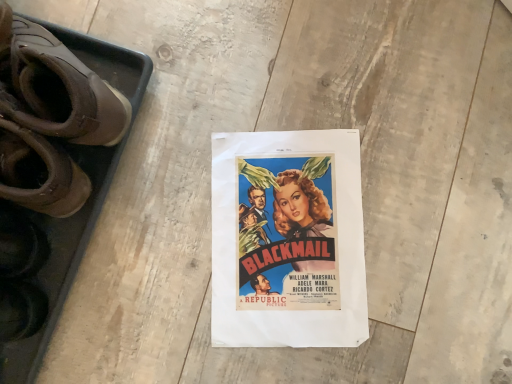
This screenshot has width=512, height=384. I want to click on vivid paper poster at center, so click(x=288, y=240).

The image size is (512, 384). What do you see at coordinates (288, 240) in the screenshot?
I see `vivid paper poster at center` at bounding box center [288, 240].

Image resolution: width=512 pixels, height=384 pixels. In order to click on brown leather shoes at left in this screenshot , I will do `click(62, 91)`.

What do you see at coordinates (62, 91) in the screenshot? I see `brown leather shoes at left` at bounding box center [62, 91].

Measure the distance between point (47, 46) and camera.

They are 22.72 inches apart.

Where is `vivid paper poster at center`? vivid paper poster at center is located at coordinates (288, 240).

Which is more to the left, vivid paper poster at center or brown leather shoes at left?

From the viewer's perspective, brown leather shoes at left appears more on the left side.

Is the depth of vivid paper poster at center greater than that of brown leather shoes at left?

Yes, vivid paper poster at center is further from the camera.

Which point is more distant from viewer, (264, 236) or (120, 135)?

The point (264, 236) is behind.

From the image's perspective, which is above, vivid paper poster at center or brown leather shoes at left?

brown leather shoes at left appears higher in the image.

From a real-world perspective, which object stands above the other?

brown leather shoes at left is physically above.

Between vivid paper poster at center and brown leather shoes at left, which one has larger width?

vivid paper poster at center.

Does vivid paper poster at center have a lesser height compared to brown leather shoes at left?

Correct, vivid paper poster at center is not as tall as brown leather shoes at left.

Based on their sizes in the image, would you say vivid paper poster at center is bigger or smaller than brown leather shoes at left?

Considering their sizes, vivid paper poster at center takes up less space than brown leather shoes at left.

Is brown leather shoes at left inside vivid paper poster at center?

No, brown leather shoes at left is not a part of vivid paper poster at center.

Would you say vivid paper poster at center is a long distance from brown leather shoes at left?

No, there isn't a large distance between vivid paper poster at center and brown leather shoes at left.

Does vivid paper poster at center turn towards brown leather shoes at left?

No, vivid paper poster at center is not aimed at brown leather shoes at left.

How different are the orientations of vivid paper poster at center and brown leather shoes at left in degrees?

The facing directions of vivid paper poster at center and brown leather shoes at left are 125 degrees apart.

This screenshot has width=512, height=384. Find the location of `footwear above the vivid paper poster at center (from the image's perspective)`. footwear above the vivid paper poster at center (from the image's perspective) is located at coordinates (62, 91).

Would you say brown leather shoes at left is to the left or to the right of vivid paper poster at center in the picture?

In the image, brown leather shoes at left appears on the left side of vivid paper poster at center.

Which object is further away from the camera, brown leather shoes at left or vivid paper poster at center?

vivid paper poster at center is further away from the camera.

Which point is more forward, [53,55] or [252,331]?

The point [53,55] is more forward.

From the image's perspective, relative to vivid paper poster at center, is brown leather shoes at left above or below?

brown leather shoes at left is above vivid paper poster at center.

From a real-world perspective, which object stands above the other?

brown leather shoes at left.

Based on the photo, is brown leather shoes at left thinner than vivid paper poster at center?

Answer: Yes.

Can you confirm if brown leather shoes at left is taller than vivid paper poster at center?

Yes, brown leather shoes at left is taller than vivid paper poster at center.

Which of these two, brown leather shoes at left or vivid paper poster at center, is smaller?

vivid paper poster at center is smaller.

Is brown leather shoes at left outside of vivid paper poster at center?

Indeed, brown leather shoes at left is completely outside vivid paper poster at center.

Is brown leather shoes at left touching vivid paper poster at center?

No, brown leather shoes at left is not in contact with vivid paper poster at center.

Could you tell me if brown leather shoes at left is turned towards vivid paper poster at center?

No, brown leather shoes at left does not turn towards vivid paper poster at center.

Identify the location of poster behind the brown leather shoes at left. The height and width of the screenshot is (384, 512). (288, 240).

This screenshot has height=384, width=512. I want to click on poster located underneath the brown leather shoes at left (from a real-world perspective), so (x=288, y=240).

At what (x,y) coordinates should I click in order to perform the action: click on poster behind the brown leather shoes at left. Please return your answer as a coordinate pair (x, y). Image resolution: width=512 pixels, height=384 pixels. Looking at the image, I should click on (288, 240).